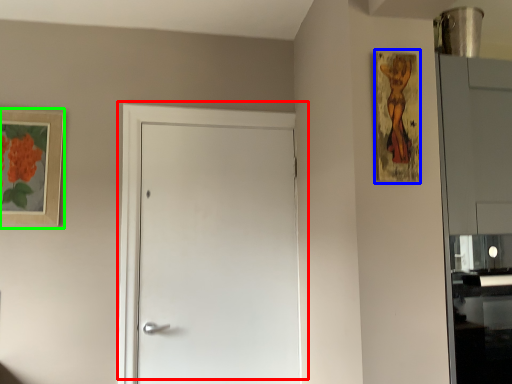
Question: Which object is the closest to the door (highlighted by a red box)? Choose among these: picture frame (highlighted by a blue box) or picture frame (highlighted by a green box).

Choices:
 (A) picture frame
 (B) picture frame

Answer: (B)